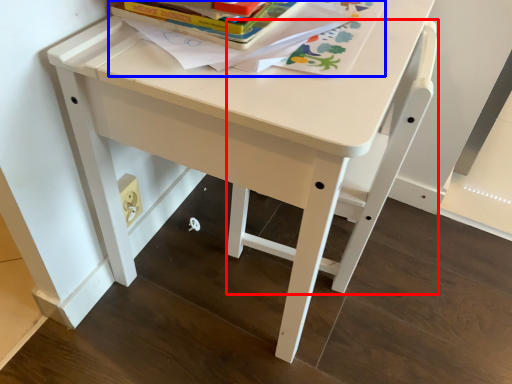
Question: Which object appears farthest to the camera in this image, chair (highlighted by a red box) or book (highlighted by a blue box)?

Choices:
 (A) chair
 (B) book

Answer: (A)